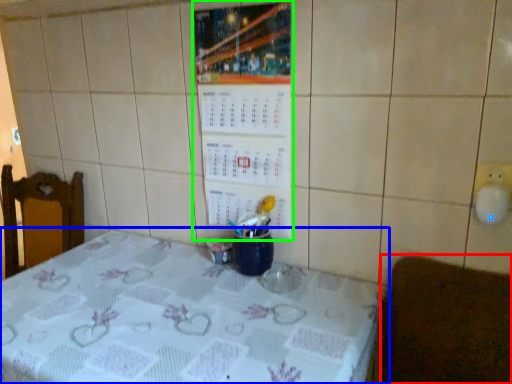
Question: Considering the real-world distances, which object is closest to furniture (highlighted by a red box)? table (highlighted by a blue box) or bulletin board (highlighted by a green box).

Choices:
 (A) table
 (B) bulletin board

Answer: (A)